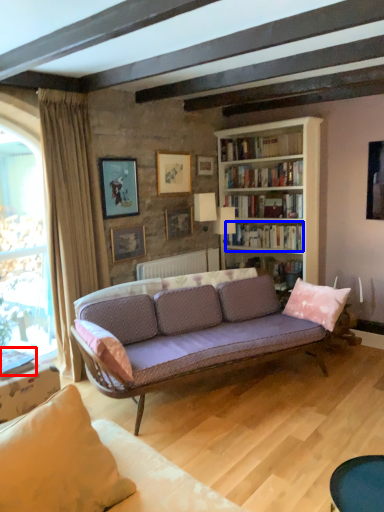
Question: Which object appears closest to the camera in this image, book (highlighted by a red box) or book (highlighted by a blue box)?

Choices:
 (A) book
 (B) book

Answer: (A)